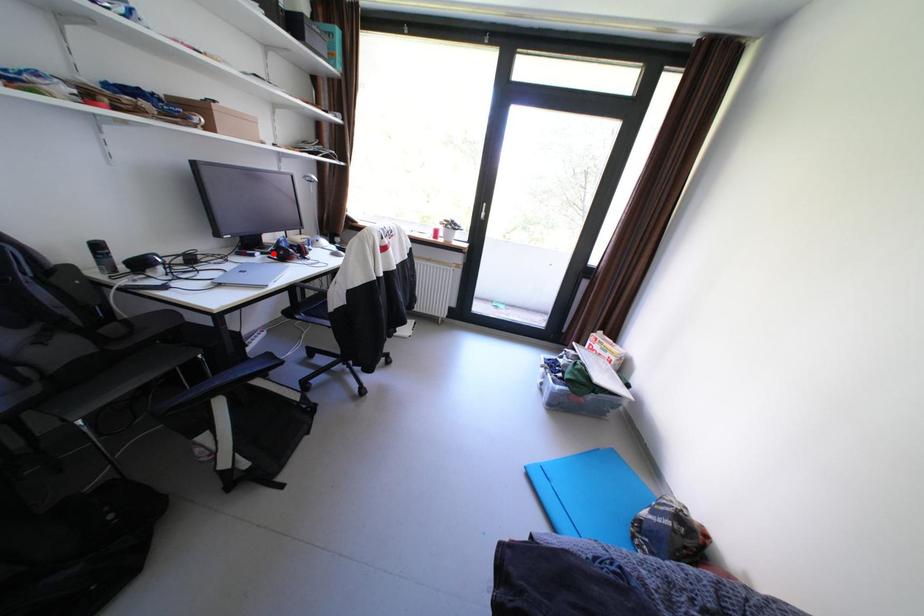
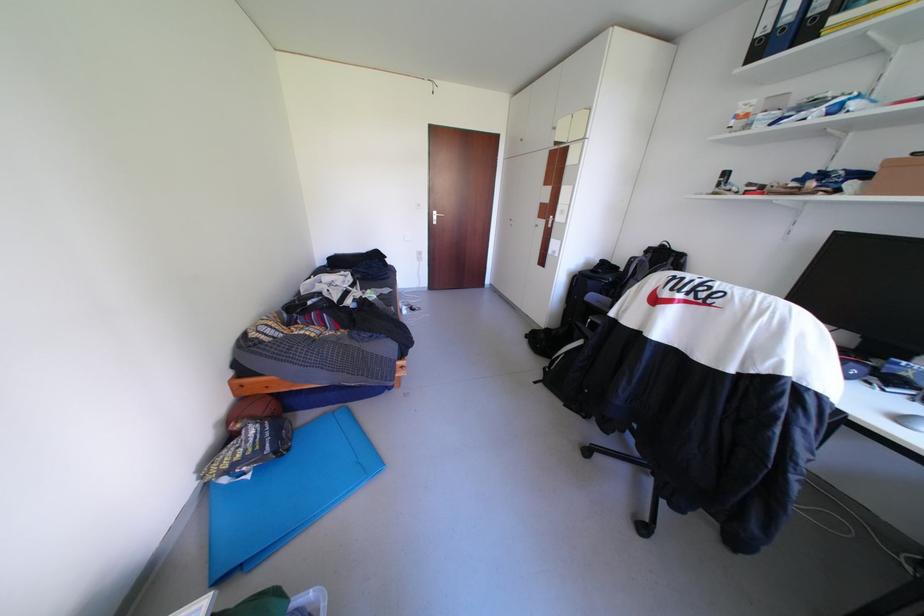
Question: I am providing you with two images of the same scene from different viewpoints. A red point is marked on the first image. Is the red point's position out of view in image 2?

Choices:
 (A) Yes
 (B) No

Answer: (A)